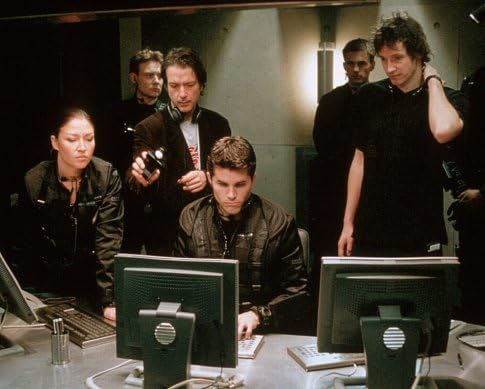
In order to click on computer keyboards in this screenshot , I will do `click(318, 359)`, `click(248, 344)`, `click(88, 323)`.